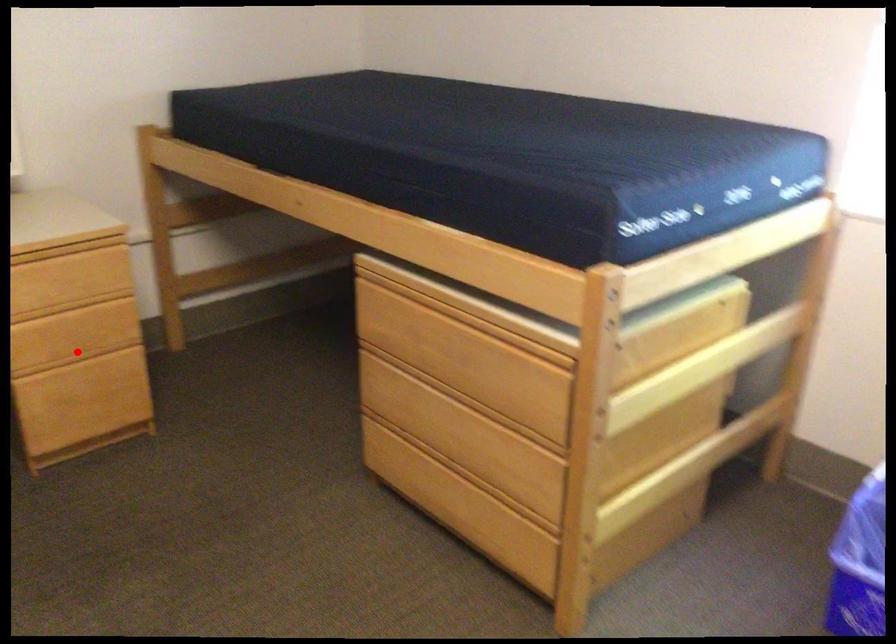
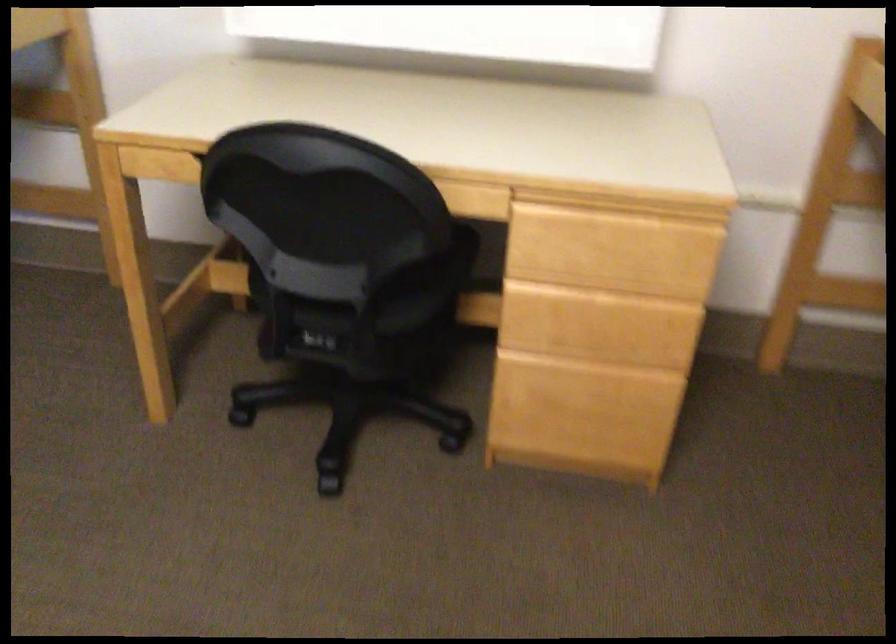
Find the pixel in the second image that matches the highlighted location in the first image.

(586, 353)